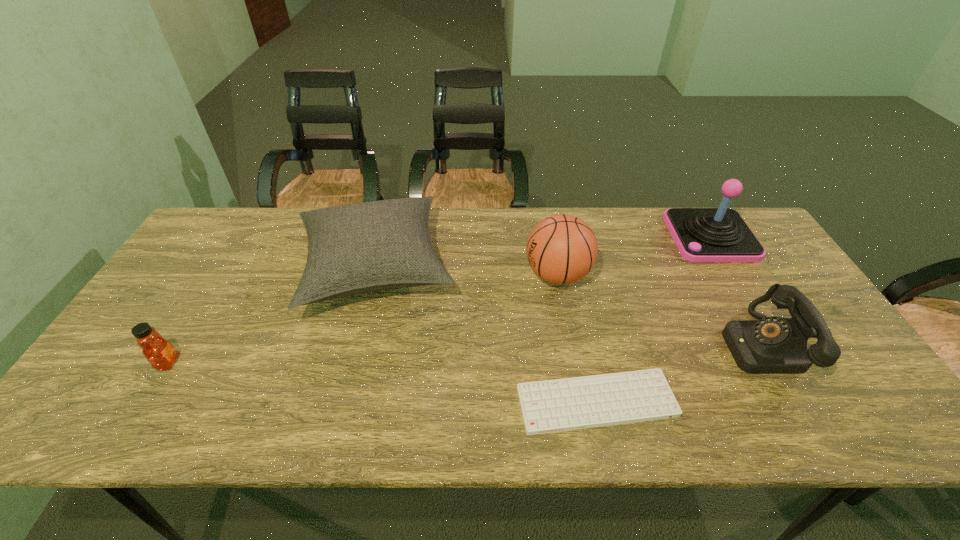
Image resolution: width=960 pixels, height=540 pixels. I want to click on joystick, so (x=720, y=234).

Locate an element on the screen. basketball is located at coordinates (561, 249).

The image size is (960, 540). What are the coordinates of `cushion` in the screenshot? It's located at (358, 248).

This screenshot has height=540, width=960. I want to click on telephone, so click(771, 345).

Where is `the leftmost object`? This screenshot has height=540, width=960. the leftmost object is located at coordinates (160, 353).

The width and height of the screenshot is (960, 540). Find the location of `the fifth tallest object`. the fifth tallest object is located at coordinates (160, 353).

Identify the location of computer keyboard. coord(567,404).

Locate an element on the screen. The width and height of the screenshot is (960, 540). free space located forward from the base of the joystick is located at coordinates (650, 237).

The image size is (960, 540). Identify the location of vacant space situated forward from the base of the joystick. (585, 237).

Find the location of a particular element. The width and height of the screenshot is (960, 540). free spot located forward from the base of the joystick is located at coordinates (585, 237).